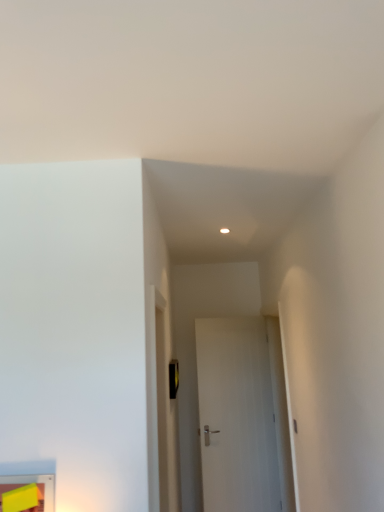
Looking at this image, measure the distance between point (237,509) and camera.

A distance of 12.03 feet exists between point (237,509) and camera.

What do you see at coordinates (236, 416) in the screenshot?
I see `white wood door at center` at bounding box center [236, 416].

The image size is (384, 512). I want to click on white wood door at center, so click(x=236, y=416).

Locate an element on the screen. The width and height of the screenshot is (384, 512). white wood door at center is located at coordinates (236, 416).